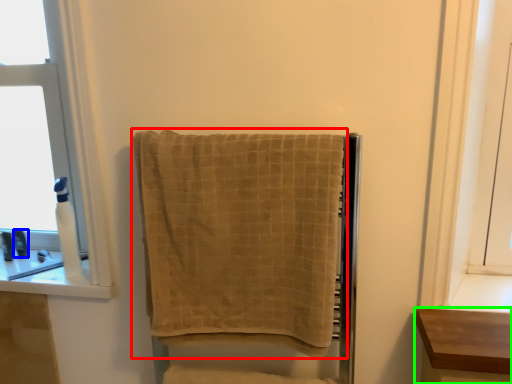
Question: Estimate the real-world distances between objects in this image. Which object is closer to towel (highlighted by a red box), toiletry (highlighted by a blue box) or furniture (highlighted by a green box)?

Choices:
 (A) toiletry
 (B) furniture

Answer: (B)